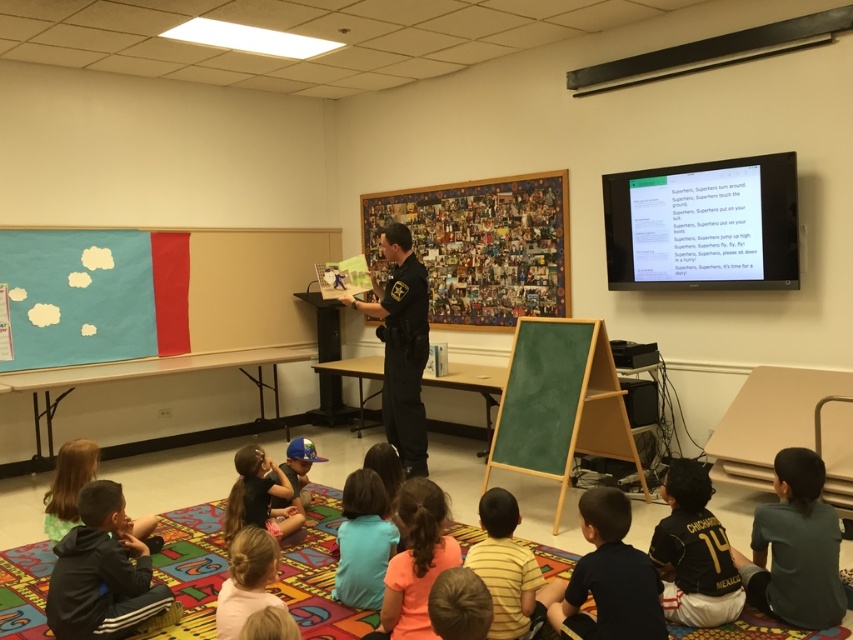
Question: Is light brown hair at lower center thinner than blue matte baseball cap at center?

Choices:
 (A) yes
 (B) no

Answer: (B)

Question: Is black fleece jacket at lower left closer to camera compared to blue matte baseball cap at center?

Choices:
 (A) no
 (B) yes

Answer: (B)

Question: Which point is closer to the camera?

Choices:
 (A) (494, 632)
 (B) (57, 467)

Answer: (A)

Question: Does light blue shirt at lower center have a lesser width compared to blue fabric cap at center?

Choices:
 (A) no
 (B) yes

Answer: (B)

Question: Which object is positioned closest to the orange t-shirt at lower center?

Choices:
 (A) dark blue shirt at lower right
 (B) black uniform at center
 (C) brown fuzzy hat at lower center
 (D) striped cotton shirt at lower center

Answer: (D)

Question: Which point is farther to the camera?

Choices:
 (A) (234, 602)
 (B) (415, 570)
 (C) (142, 550)

Answer: (C)